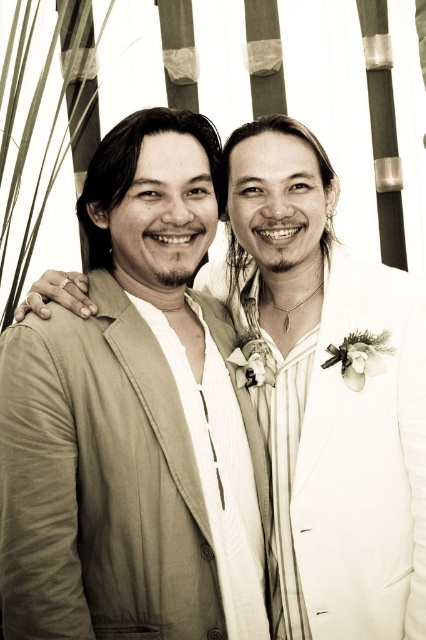
Question: Can you confirm if light beige fabric business suit at left is positioned above white satin suit at right?

Choices:
 (A) yes
 (B) no

Answer: (B)

Question: Can you confirm if light beige fabric business suit at left is positioned above white satin suit at right?

Choices:
 (A) no
 (B) yes

Answer: (A)

Question: Which object is farther from the camera taking this photo?

Choices:
 (A) light beige fabric business suit at left
 (B) white satin suit at right

Answer: (B)

Question: Among these points, which one is nearest to the camera?

Choices:
 (A) (58, 592)
 (B) (333, 563)

Answer: (A)

Question: Does light beige fabric business suit at left appear under white satin suit at right?

Choices:
 (A) yes
 (B) no

Answer: (A)